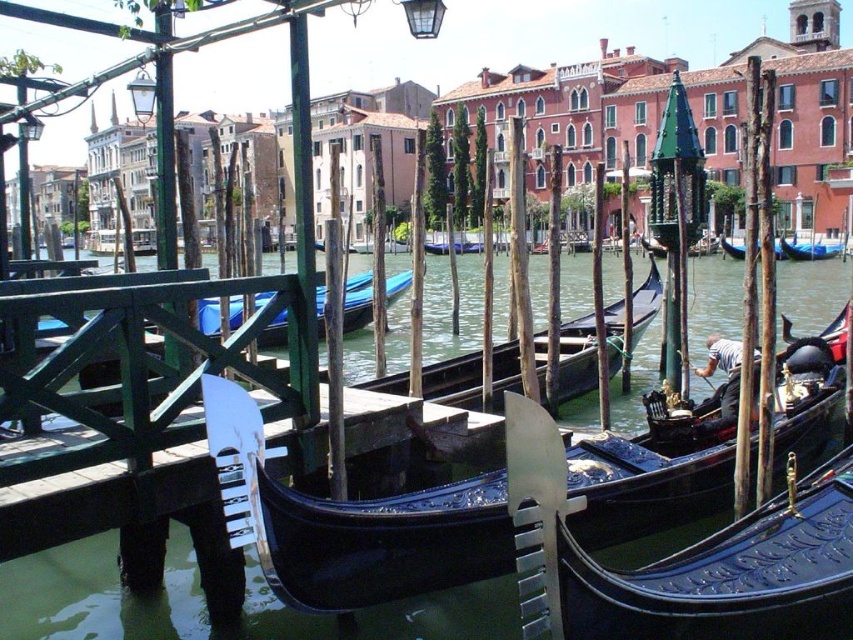
You are standing at the point with coordinates (691, 566) in the Venice canal scene. What object are you most likely standing on?

You are most likely standing on the black polished wood gondola at center, as the coordinates point (691, 566) represent its location.

You are a tourist in Venice and want to take a photo of both the black polished wood gondola at center and the black polished gondola at center. Since you want them both in the frame, which gondola should you position closer to the camera to ensure both are visible?

The black polished wood gondola at center is smaller in size compared to the black polished gondola at center. To include both in the frame, position the smaller black polished wood gondola at center closer to the camera so it appears larger and balances with the larger black polished gondola at center in the background.

You are a tourist standing on the bridge overlooking the canal. You see two gondolas labeled as black polished wood gondola at center and black polished gondola at center. Which one is positioned lower in the scene?

The black polished wood gondola at center is positioned lower than the black polished gondola at center in the scene.